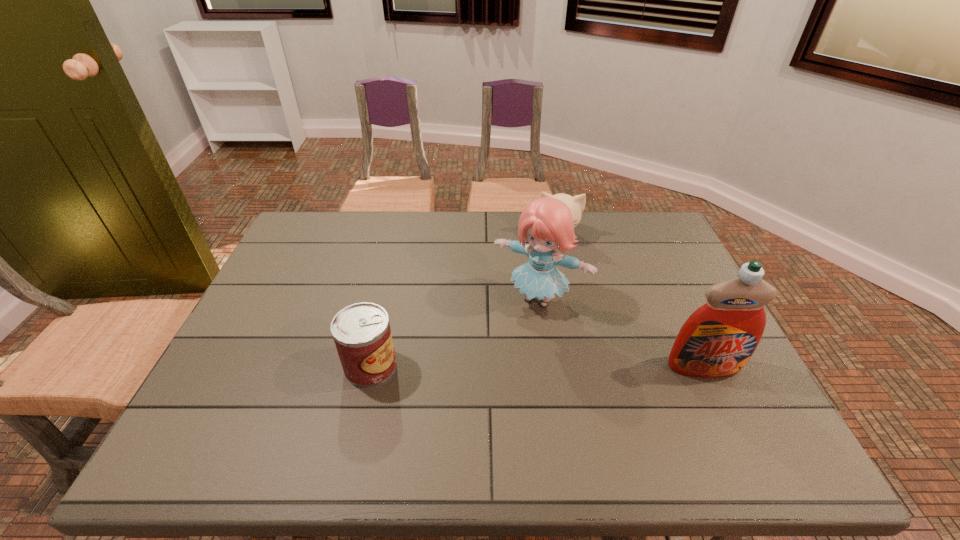
Locate an element on the screen. the leftmost object is located at coordinates (362, 334).

The image size is (960, 540). I want to click on the rightmost object, so click(717, 340).

Locate an element on the screen. kitten is located at coordinates (576, 204).

Find the location of a particular element. the third nearest object is located at coordinates (546, 223).

Locate an element on the screen. The height and width of the screenshot is (540, 960). free space located 0.290m on the back of the leftmost object is located at coordinates (393, 271).

Where is `vacant point located 0.060m on the front surface of the rightmost object`? Image resolution: width=960 pixels, height=540 pixels. vacant point located 0.060m on the front surface of the rightmost object is located at coordinates (721, 403).

The width and height of the screenshot is (960, 540). Find the location of `blank area located on the face of the kitten`. blank area located on the face of the kitten is located at coordinates (560, 276).

The image size is (960, 540). What are the coordinates of `free space located on the face of the kitten` in the screenshot? It's located at (561, 302).

Locate an element on the screen. The height and width of the screenshot is (540, 960). vacant region located 0.170m on the face of the kitten is located at coordinates (560, 283).

You are a GUI agent. You are given a task and a screenshot of the screen. Output one action in this format:
    pyautogui.click(x=<x>, y=<y>)
    Task: Click on the vacant space located 0.110m on the front-facing side of the doll
    The image size is (960, 540).
    Given the screenshot: What is the action you would take?
    pyautogui.click(x=502, y=345)